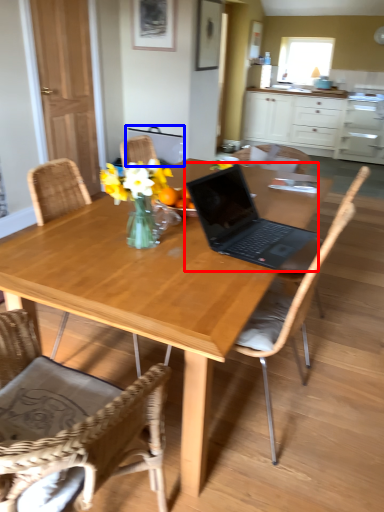
Question: Which object appears closest to the camera in this image, laptop (highlighted by a red box) or armchair (highlighted by a blue box)?

Choices:
 (A) laptop
 (B) armchair

Answer: (A)